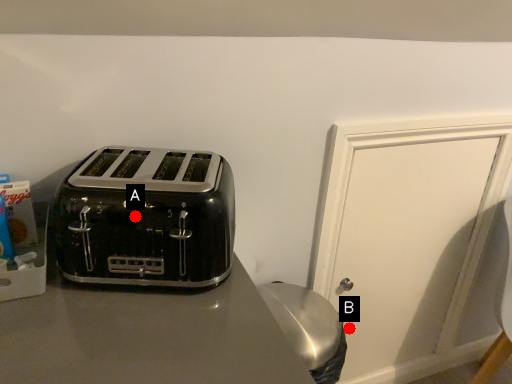
Question: Two points are circled on the image, labeled by A and B beside each circle. Which point appears farthest from the camera in this image?

Choices:
 (A) A is further
 (B) B is further

Answer: (B)